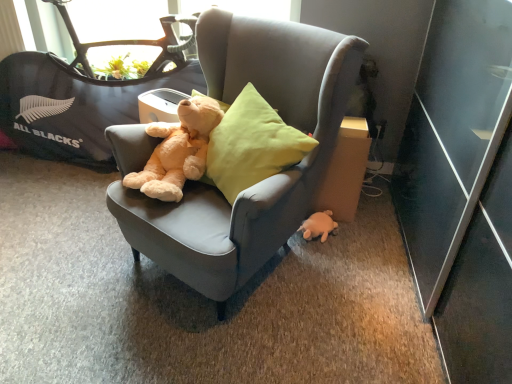
Identify the location of vacant area that is in front of velvet gray chair at center. (212, 348).